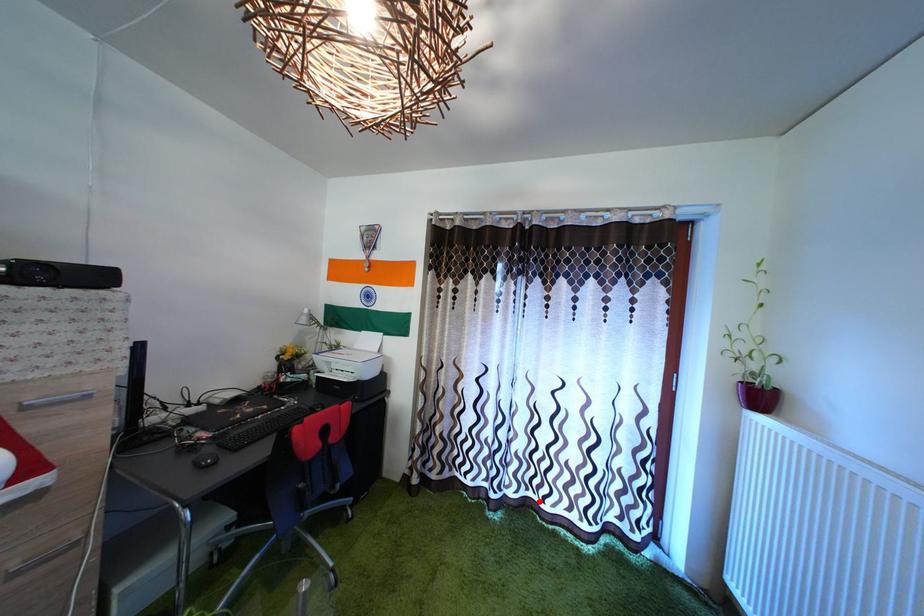
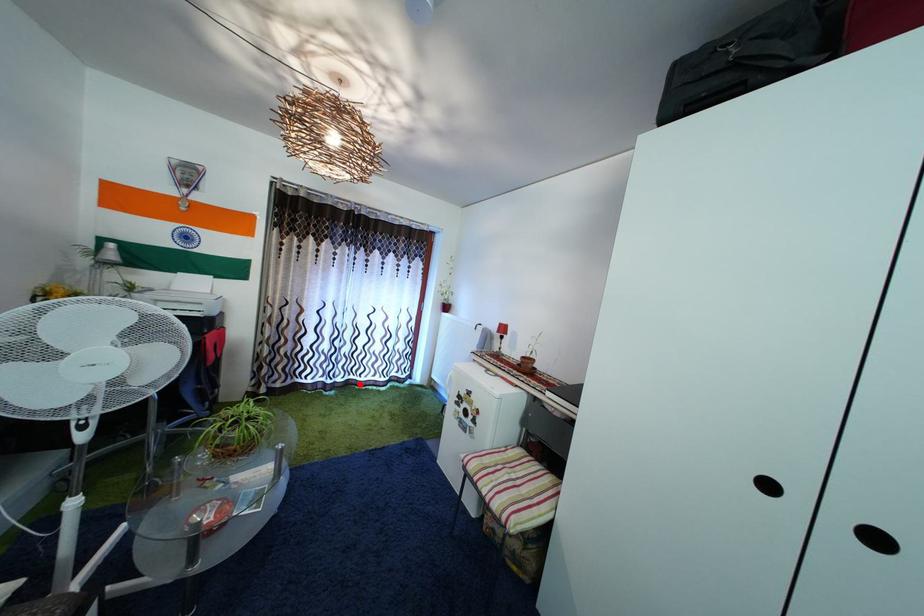
I am providing you with two images of the same scene from different viewpoints. A red point is marked on the first image and another point is marked on the second image. Do the highlighted points in image1 and image2 indicate the same real-world spot?

Yes